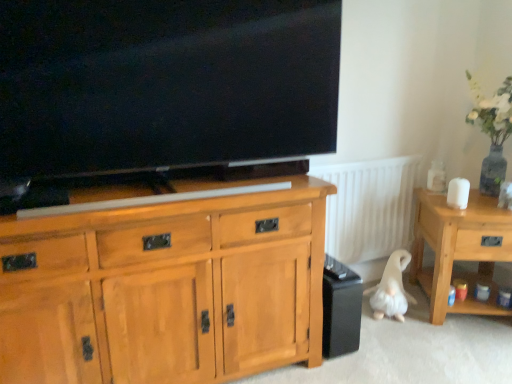
Question: Considering the positions of light wood side table at right and white plush dog at lower right in the image, is light wood side table at right bigger or smaller than white plush dog at lower right?

Choices:
 (A) big
 (B) small

Answer: (A)

Question: Does point (416, 258) appear closer or farther from the camera than point (391, 273)?

Choices:
 (A) farther
 (B) closer

Answer: (A)

Question: Estimate the real-world distances between objects in this image. Which object is farther from the white ribbed radiator at center?

Choices:
 (A) white plush dog at lower right
 (B) black matte speaker at lower right
 (C) matte black tv at upper center
 (D) light wood side table at right
 (E) light brown wood cabinet at center

Answer: (E)

Question: Estimate the real-world distances between objects in this image. Which object is closer to the light wood side table at right?

Choices:
 (A) light brown wood cabinet at center
 (B) white ribbed radiator at center
 (C) matte black tv at upper center
 (D) white plush dog at lower right
 (E) black matte speaker at lower right

Answer: (D)